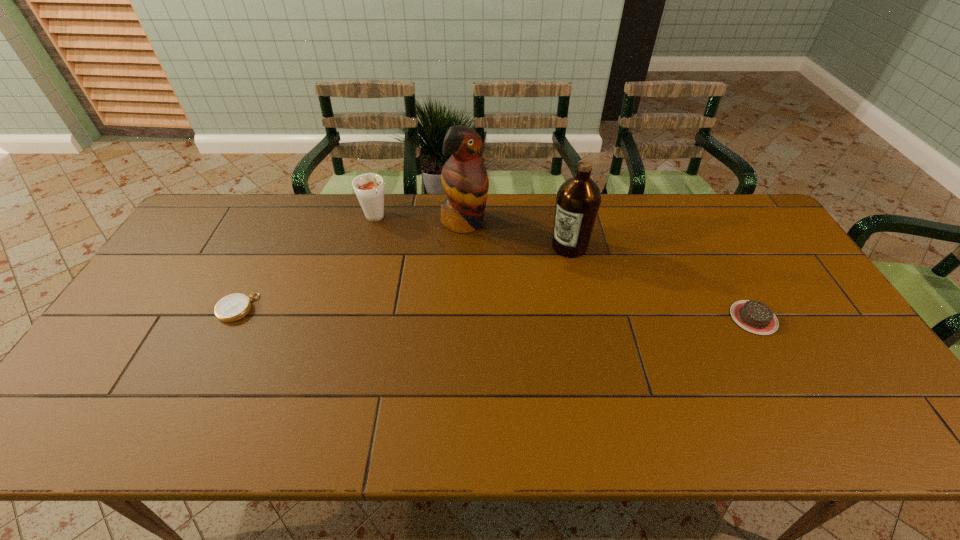
Image resolution: width=960 pixels, height=540 pixels. Find the location of `vacant position located on the drink side of the second object from left to right`. vacant position located on the drink side of the second object from left to right is located at coordinates (396, 250).

You are a GUI agent. You are given a task and a screenshot of the screen. Output one action in this format:
    pyautogui.click(x=<x>, y=<y>)
    Task: Click on the olive oil situated at the far edge
    
    Given the screenshot: What is the action you would take?
    pyautogui.click(x=578, y=200)

Identify the location of parrot that is at the far edge. The image size is (960, 540). (464, 178).

At what (x,y) coordinates should I click in order to perform the action: click on root beer situated at the far edge. Please return your answer as a coordinate pair (x, y). Image resolution: width=960 pixels, height=540 pixels. Looking at the image, I should click on (369, 188).

Locate an element on the screen. object present at the right edge is located at coordinates (756, 317).

The height and width of the screenshot is (540, 960). Find the location of `free point at the far edge`. free point at the far edge is located at coordinates (554, 210).

This screenshot has width=960, height=540. Identify the location of vacant space at the near edge of the desktop. (669, 386).

The image size is (960, 540). I want to click on blank space at the left edge, so click(143, 293).

You are a GUI agent. You are given a task and a screenshot of the screen. Output one action in this format:
    pyautogui.click(x=<x>, y=<y>)
    Task: Click on the vacant area at the right edge of the desktop
    
    Given the screenshot: What is the action you would take?
    [755, 251]

I want to click on free space at the far left corner of the desktop, so click(x=215, y=206).